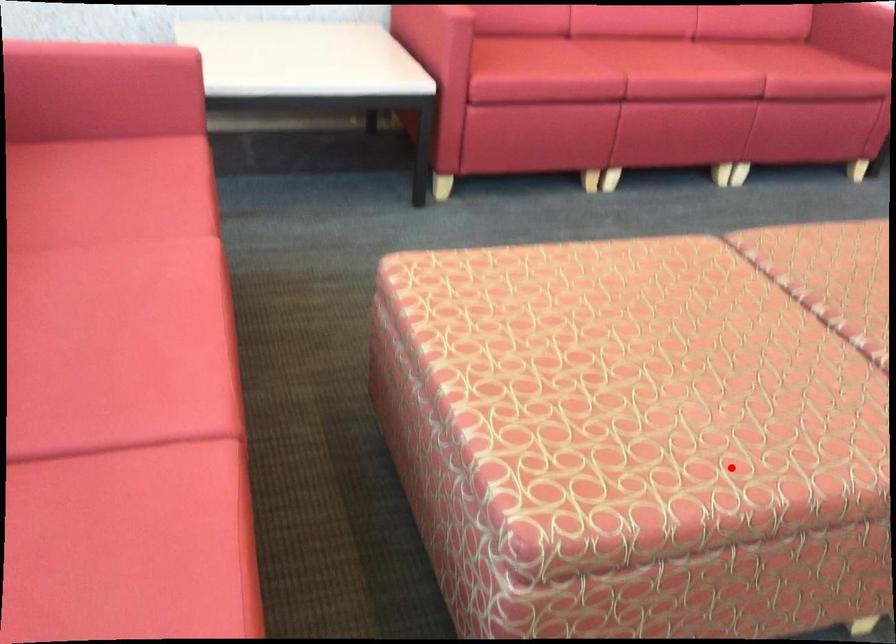
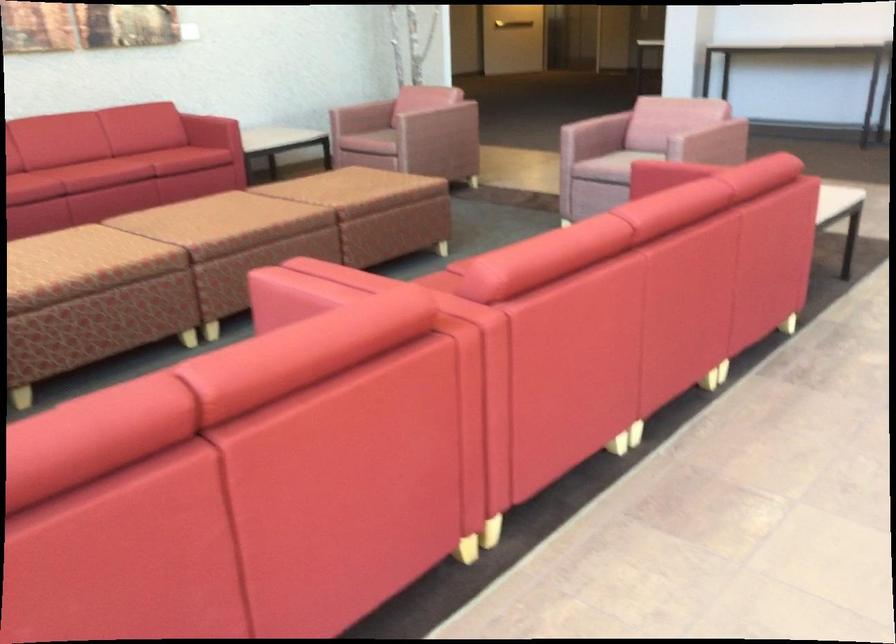
The point at the highlighted location is marked in the first image. Where is the corresponding point in the second image?

(83, 265)